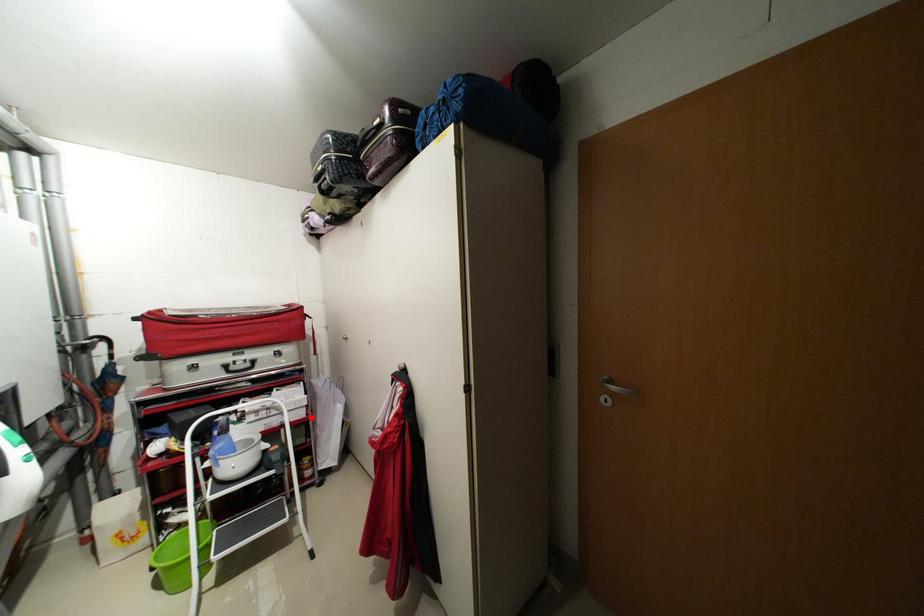
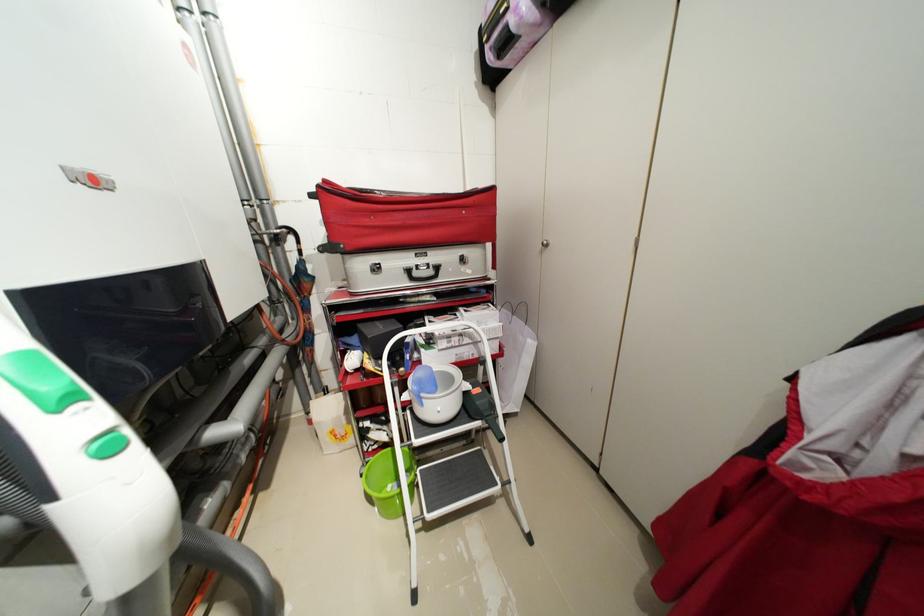
Question: I am providing you with two images of the same scene from different viewpoints. A red point is shown in image1. For the corresponding object point in image2, is it positioned nearer or farther from the camera?

Choices:
 (A) Nearer
 (B) Farther

Answer: (B)